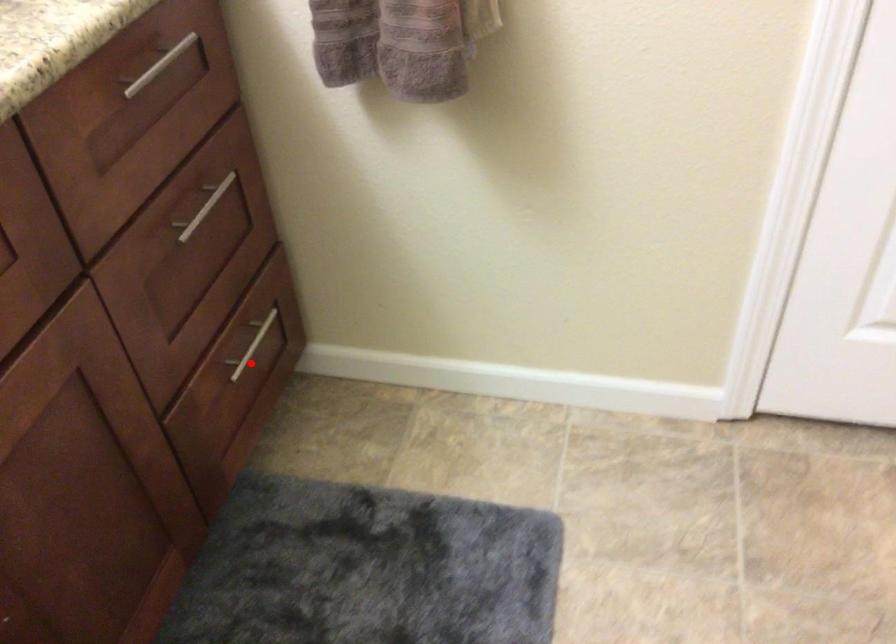
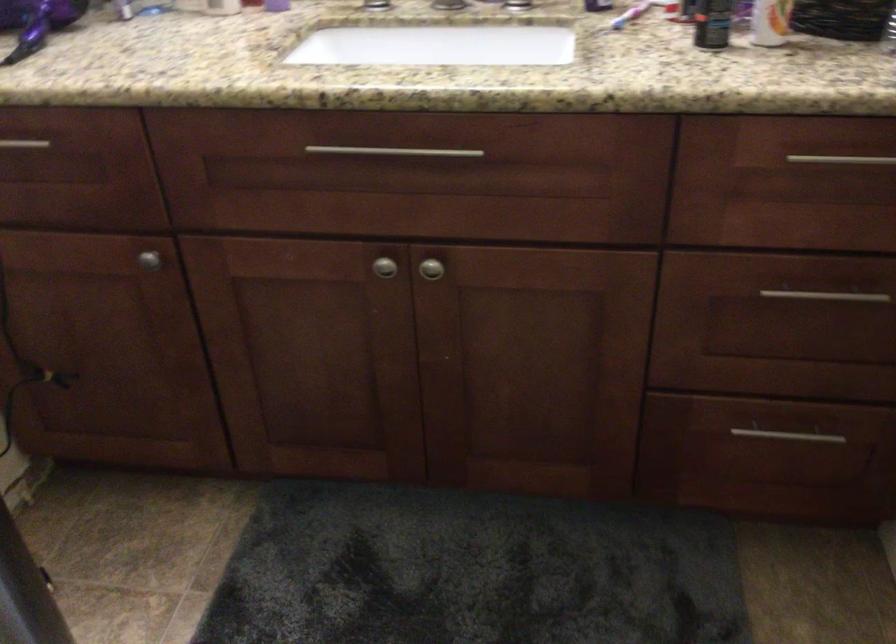
Question: I am providing you with two images of the same scene from different viewpoints. A red point is marked on the first image. At the location where the point appears in image 1, is it still visible in image 2?

Choices:
 (A) Yes
 (B) No

Answer: (A)